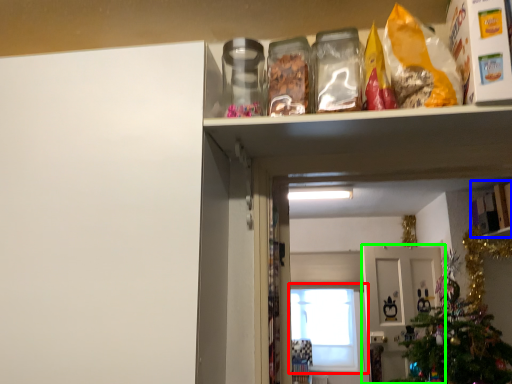
Question: Based on their relative distances, which object is nearer to window (highlighted by a red box)? Choose from cabinet (highlighted by a blue box) and door (highlighted by a green box).

Choices:
 (A) cabinet
 (B) door

Answer: (B)